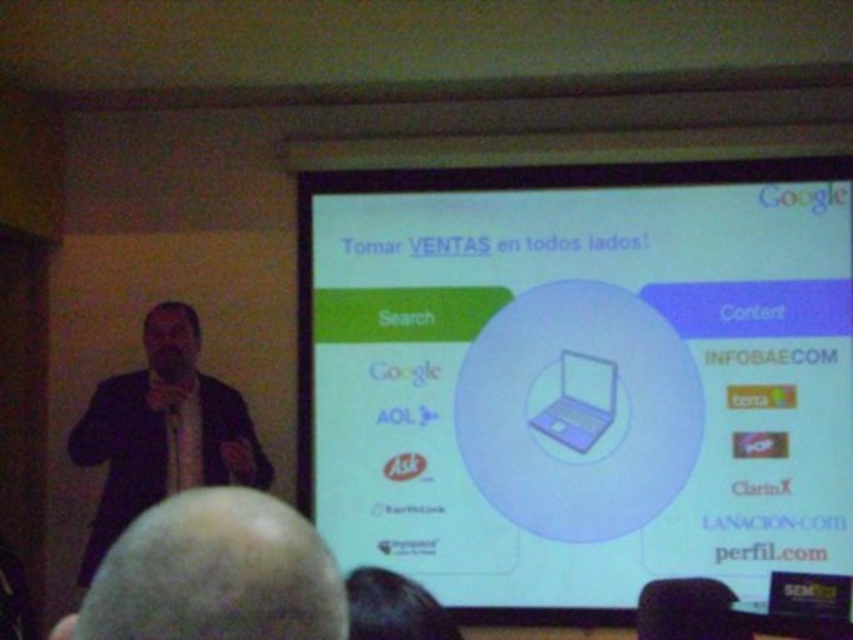
Question: Does white glossy laptop at center have a lesser width compared to dark suit at left?

Choices:
 (A) no
 (B) yes

Answer: (A)

Question: Is smooth bald head at lower left positioned at the back of dark suit at left?

Choices:
 (A) yes
 (B) no

Answer: (A)

Question: Which point is closer to the camera?

Choices:
 (A) white glossy laptop at center
 (B) dark suit at left

Answer: (B)

Question: Is white glossy laptop at center wider than smooth bald head at lower left?

Choices:
 (A) yes
 (B) no

Answer: (A)

Question: Which of the following is the farthest from the observer?

Choices:
 (A) dark suit at left
 (B) white glossy laptop at center
 (C) smooth bald head at lower left

Answer: (B)

Question: Which object appears farthest from the camera in this image?

Choices:
 (A) white glossy laptop at center
 (B) dark suit at left
 (C) smooth bald head at lower left

Answer: (A)